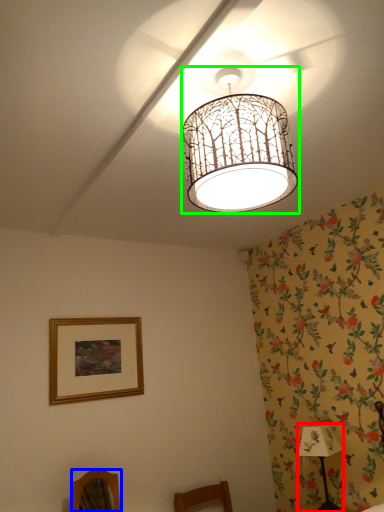
Question: Which object is the farthest from table lamp (highlighted by a red box)? Choose among these: furniture (highlighted by a blue box) or lamp (highlighted by a green box).

Choices:
 (A) furniture
 (B) lamp

Answer: (B)